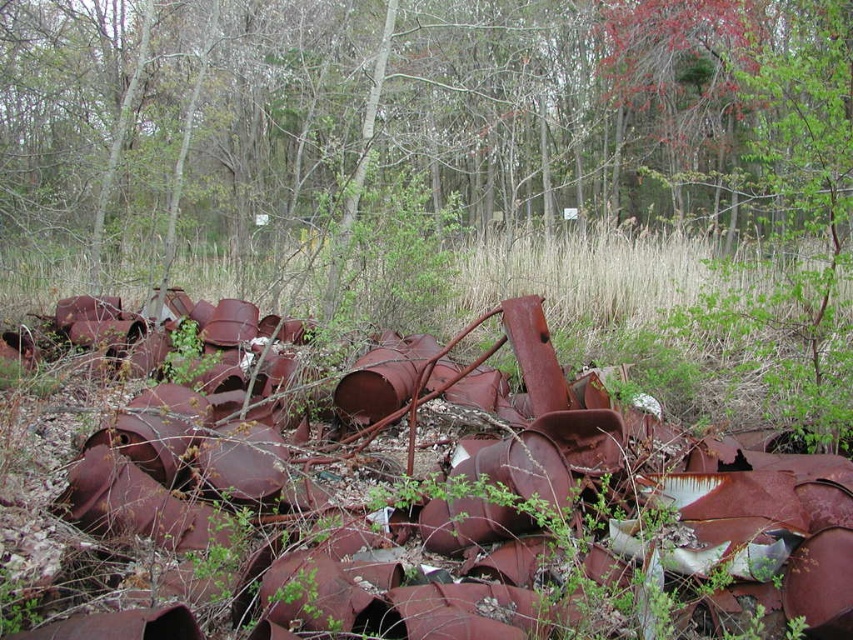
You are a hiker who has stumbled upon this neglected area. You notice the rusty metal pipes at center and the brown dry grass at center. Which object is closer to the ground?

The rusty metal pipes at center are closer to the ground because they are positioned below the brown dry grass at center.

You are a landscape architect designing a restoration plan for this area. You see the rusty metal pipes at center and the brown dry grass at center. Which object is positioned to the right side of the other?

The rusty metal pipes at center are to the right of the brown dry grass at center.